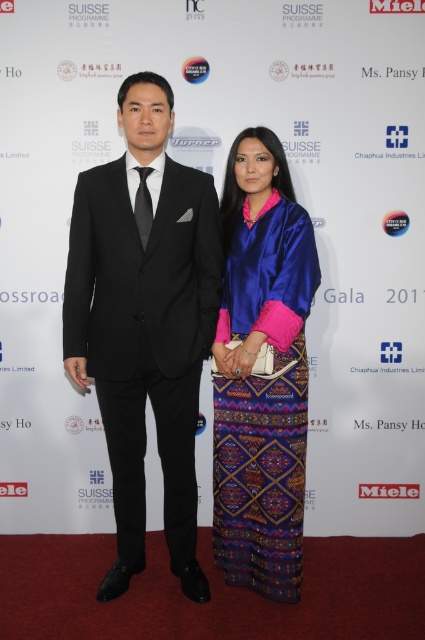
You are a photographer at the event and need to adjust the lighting so that both the black satin suit at left and the silky blue dress at center are equally visible. Considering their heights, which one might require more focused lighting adjustments?

The black satin suit at left has a greater height compared to the silky blue dress at center, so the taller black satin suit at left may require more focused lighting adjustments to ensure visibility.

You are a photographer standing at a certain position. You need to capture a closeup shot of the black satin suit at left. Given that your camera has a minimum focusing distance of 1.8 meters, will you be able to take the photo without moving closer?

The distance between the black satin suit at left and the viewer is 2.04 meters. Since the camera requires a minimum focusing distance of 1.8 meters, you can take the closeup shot without moving closer as the current distance is sufficient.